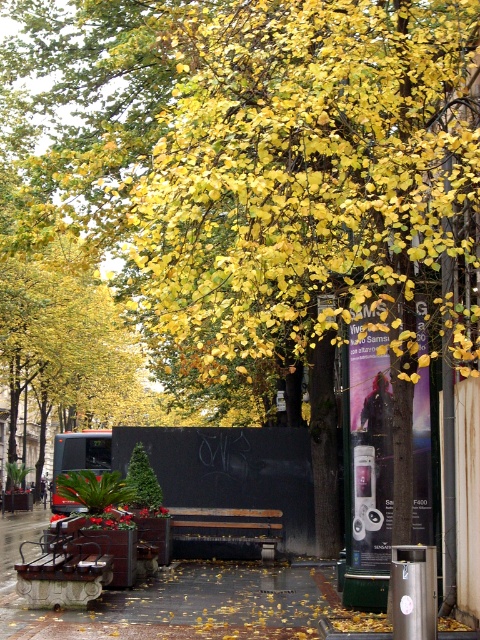
Question: Considering the relative positions of rustic wood bench at lower left and rusty metal bench at center in the image provided, where is rustic wood bench at lower left located with respect to rusty metal bench at center?

Choices:
 (A) left
 (B) right

Answer: (A)

Question: Does rustic wood bench at lower left appear on the left side of rusty metal bench at center?

Choices:
 (A) no
 (B) yes

Answer: (B)

Question: Does rustic wood bench at lower left have a lesser width compared to rusty metal bench at center?

Choices:
 (A) yes
 (B) no

Answer: (A)

Question: Which point is farther to the camera?

Choices:
 (A) rusty metal bench at center
 (B) rustic wood bench at lower left

Answer: (A)

Question: Which point is closer to the camera?

Choices:
 (A) (32, 573)
 (B) (277, 538)

Answer: (A)